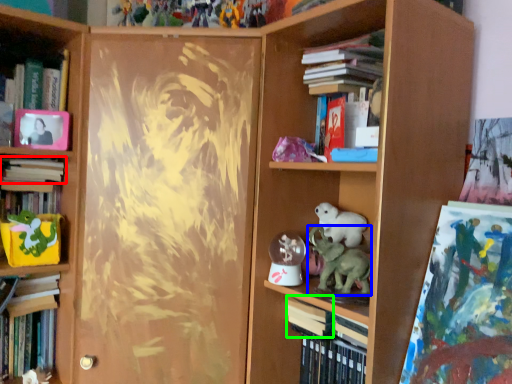
Question: Which object is the closest to the book (highlighted by a red box)? Choose among these: animal (highlighted by a blue box) or paperback book (highlighted by a green box).

Choices:
 (A) animal
 (B) paperback book

Answer: (B)